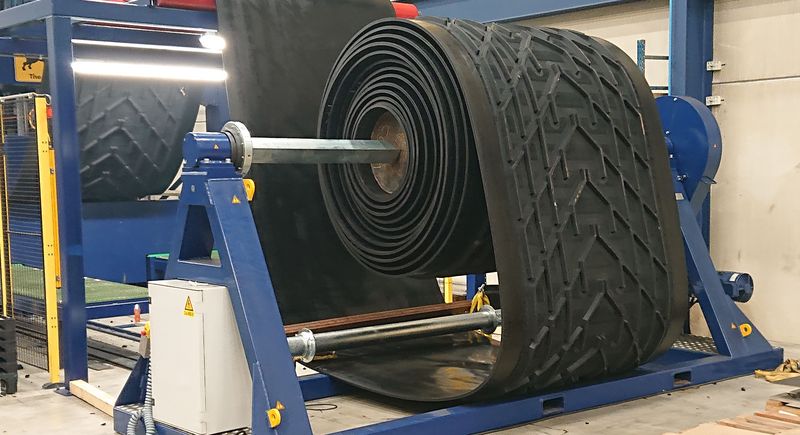
I want to click on white background wall, so click(x=754, y=166).